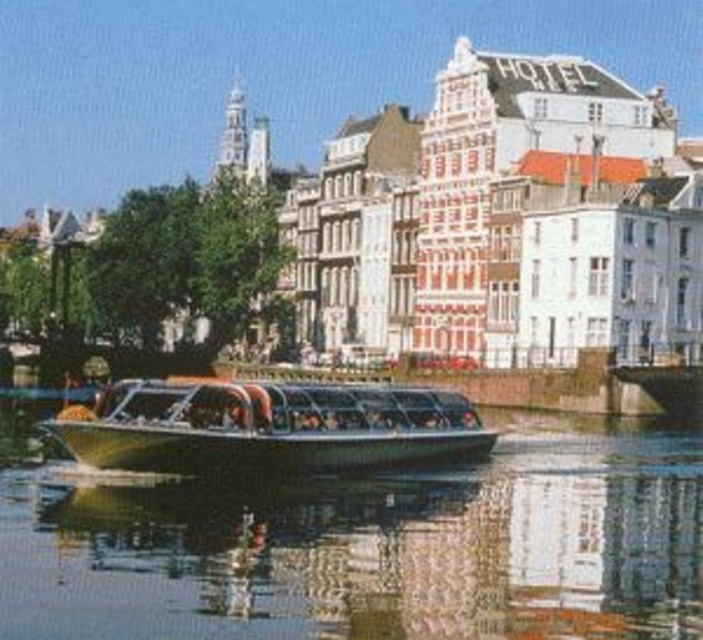
You are a tour guide explaining the boats on the canal to visitors. You need to highlight the differences between the metallic gray boat at center and the metallic glass boat at center. Which boat is taller?

The metallic gray boat at center is taller than the metallic glass boat at center.

You are a tourist planning to take a boat ride on the canal. You see two boats at the center of the scene, a metallic gray boat at center and a metallic glass boat at center. Which one can accommodate more passengers?

The metallic gray boat at center is bigger than the metallic glass boat at center, so it can accommodate more passengers.